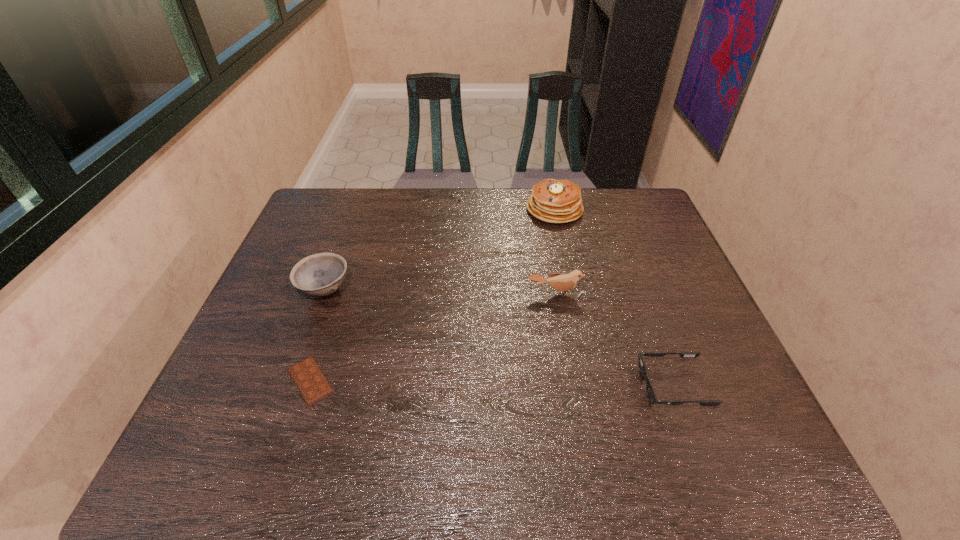
Find the location of a particular element. This screenshot has width=960, height=540. pancake is located at coordinates point(553,201).

Identify the location of bird. This screenshot has height=540, width=960. (562, 282).

Locate an element on the screen. The height and width of the screenshot is (540, 960). bowl is located at coordinates (321, 274).

This screenshot has height=540, width=960. I want to click on sunglasses, so click(651, 395).

Identify the location of the rightmost object. This screenshot has width=960, height=540. (651, 395).

At what (x,y) coordinates should I click in order to perform the action: click on the shortest object. Please return your answer as a coordinate pair (x, y). Looking at the image, I should click on (309, 379).

In order to click on free space located on the front of the pancake in this screenshot , I will do `click(563, 247)`.

You are a GUI agent. You are given a task and a screenshot of the screen. Output one action in this format:
    pyautogui.click(x=<x>, y=<y>)
    Task: Click on the free region located at the beak of the bird
    
    Given the screenshot: What is the action you would take?
    pyautogui.click(x=564, y=341)

Where is `vacant region located 0.140m on the back of the bowl`? The image size is (960, 540). vacant region located 0.140m on the back of the bowl is located at coordinates (343, 241).

I want to click on free space located on the temples of the sunglasses, so click(x=489, y=386).